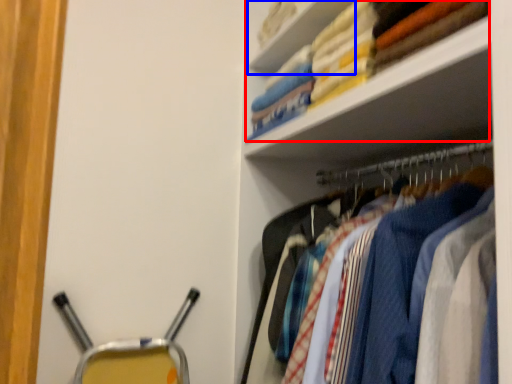
Question: Which object appears closest to the camera in this image, laundry (highlighted by a red box) or cabinet (highlighted by a blue box)?

Choices:
 (A) laundry
 (B) cabinet

Answer: (A)